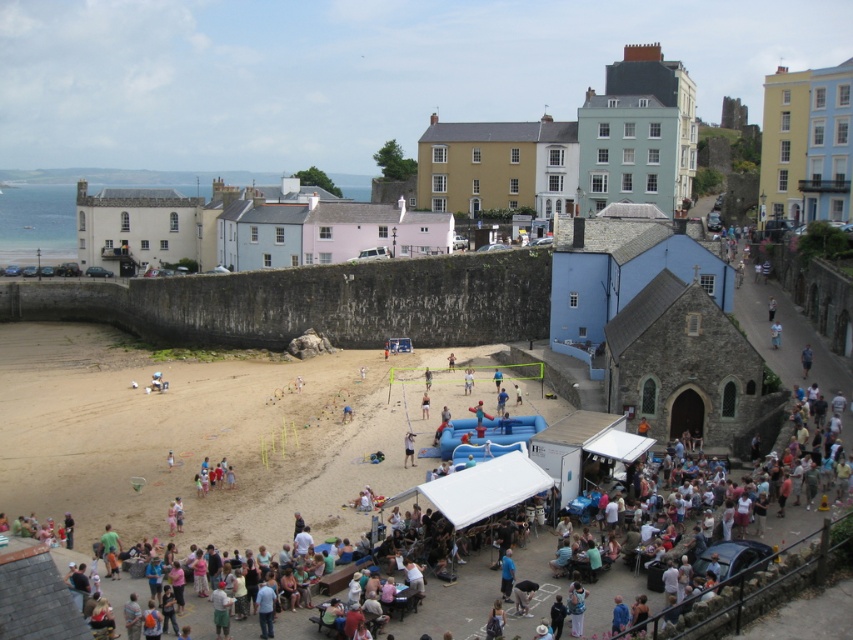
Is light brown sand at center closer to the viewer compared to light brown wooden paddle at center?

Yes, light brown sand at center is closer to the viewer.

Does light brown sand at center have a greater width compared to light brown wooden paddle at center?

Yes, light brown sand at center is wider than light brown wooden paddle at center.

In order to click on light brown sand at center in this screenshot , I will do `click(199, 436)`.